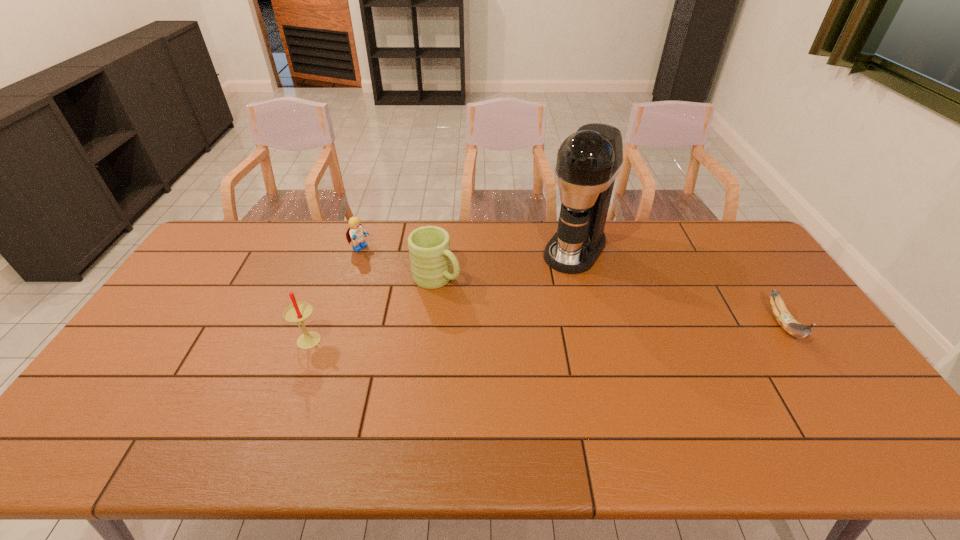
At what (x,y) coordinates should I click in order to perform the action: click on vacant space on the desktop that is between the second tallest object and the shortest object and is positioned on the side of the mug with the handle. Please return your answer as a coordinate pair (x, y). This screenshot has width=960, height=540. Looking at the image, I should click on (523, 333).

The width and height of the screenshot is (960, 540). Identify the location of vacant spot on the desktop that is between the candle and the rightmost object and is positioned place cup under the spout of the tallest object. (515, 333).

What are the coordinates of `vacant spot on the desktop that is between the second tallest object and the rightmost object and is positioned on the front-facing side of the Lego` in the screenshot? It's located at (488, 334).